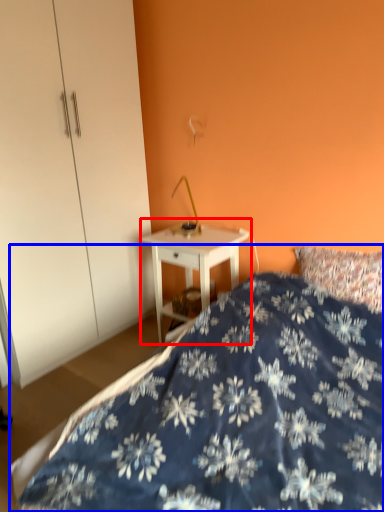
Question: Which object appears farthest to the camera in this image, nightstand (highlighted by a red box) or bed (highlighted by a blue box)?

Choices:
 (A) nightstand
 (B) bed

Answer: (A)